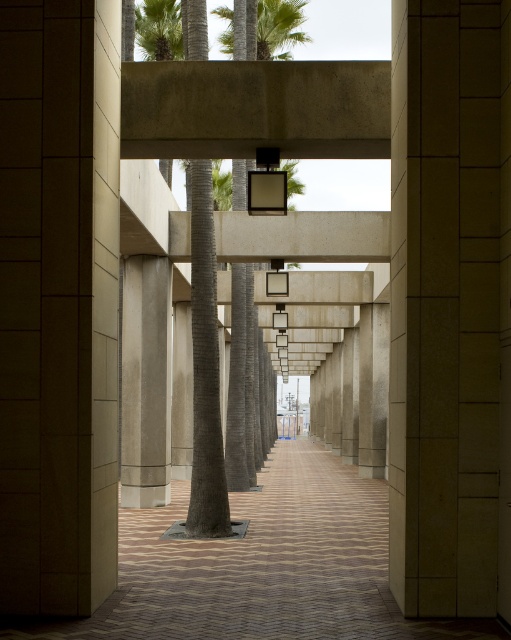
Question: Which object appears farthest from the camera in this image?

Choices:
 (A) green textured palm tree at upper center
 (B) brown brick path at lower center
 (C) sanded concrete column at center

Answer: (A)

Question: Considering the real-world distances, which object is closest to the sanded concrete column at center?

Choices:
 (A) brown brick path at lower center
 (B) green textured palm tree at upper center

Answer: (A)

Question: Does brown brick path at lower center appear on the right side of sanded concrete column at center?

Choices:
 (A) yes
 (B) no

Answer: (A)

Question: Estimate the real-world distances between objects in this image. Which object is farther from the sanded concrete column at center?

Choices:
 (A) green leafy palm tree at upper center
 (B) green textured palm tree at upper center
 (C) brown brick path at lower center

Answer: (B)

Question: Observing the image, what is the correct spatial positioning of sanded concrete column at center in reference to green textured palm tree at upper center?

Choices:
 (A) left
 (B) right

Answer: (B)

Question: Is the position of brown brick path at lower center more distant than that of green leafy palm tree at upper center?

Choices:
 (A) yes
 (B) no

Answer: (B)